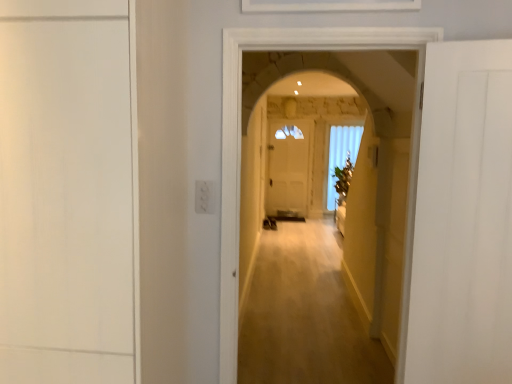
Question: Is white matte door at left, acting as the second door starting from the right, not inside white glass window at center?

Choices:
 (A) no
 (B) yes

Answer: (B)

Question: Are white matte door at left, acting as the second door starting from the right, and white glass window at center located far from each other?

Choices:
 (A) no
 (B) yes

Answer: (B)

Question: Is white matte door at left, the 1th door from the left, with white glass window at center?

Choices:
 (A) no
 (B) yes

Answer: (A)

Question: Considering the relative positions of white matte door at left, the 1th door from the left, and white glass window at center in the image provided, is white matte door at left, the 1th door from the left, behind white glass window at center?

Choices:
 (A) yes
 (B) no

Answer: (B)

Question: Considering the relative sizes of white matte door at left, the 1th door from the left, and white glass window at center in the image provided, is white matte door at left, the 1th door from the left, thinner than white glass window at center?

Choices:
 (A) yes
 (B) no

Answer: (B)

Question: From a real-world perspective, does white matte door at left, acting as the second door starting from the right, stand above white glass window at center?

Choices:
 (A) no
 (B) yes

Answer: (B)

Question: Considering the relative positions of white matte door at right, acting as the 1th door starting from the right, and white matte door at left, acting as the second door starting from the right, in the image provided, is white matte door at right, acting as the 1th door starting from the right, to the right of white matte door at left, acting as the second door starting from the right, from the viewer's perspective?

Choices:
 (A) yes
 (B) no

Answer: (A)

Question: Is white matte door at right, the second door from the left, smaller than white matte door at left, acting as the second door starting from the right?

Choices:
 (A) yes
 (B) no

Answer: (A)

Question: Is white matte door at right, acting as the 1th door starting from the right, far away from white matte door at left, acting as the second door starting from the right?

Choices:
 (A) no
 (B) yes

Answer: (B)

Question: Considering the relative positions of white matte door at right, the second door from the left, and white matte door at left, acting as the second door starting from the right, in the image provided, is white matte door at right, the second door from the left, behind white matte door at left, acting as the second door starting from the right,?

Choices:
 (A) no
 (B) yes

Answer: (B)

Question: Is the depth of white matte door at right, the second door from the left, less than that of white matte door at left, acting as the second door starting from the right?

Choices:
 (A) yes
 (B) no

Answer: (B)

Question: Can you confirm if white matte door at right, acting as the 1th door starting from the right, is positioned to the left of white matte door at left, the 1th door from the left?

Choices:
 (A) yes
 (B) no

Answer: (B)

Question: Is white matte door at right, the second door from the left, not near white glass window at center?

Choices:
 (A) yes
 (B) no

Answer: (A)